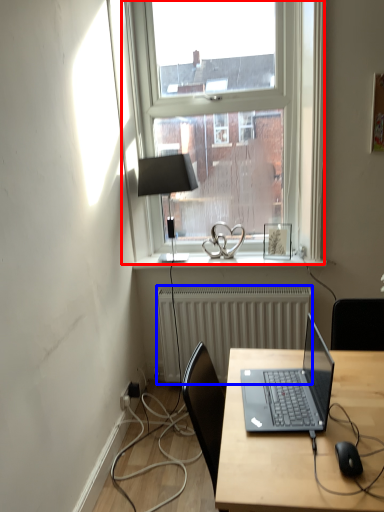
Question: Which object appears closest to the camera in this image, window (highlighted by a red box) or radiator (highlighted by a blue box)?

Choices:
 (A) window
 (B) radiator

Answer: (A)